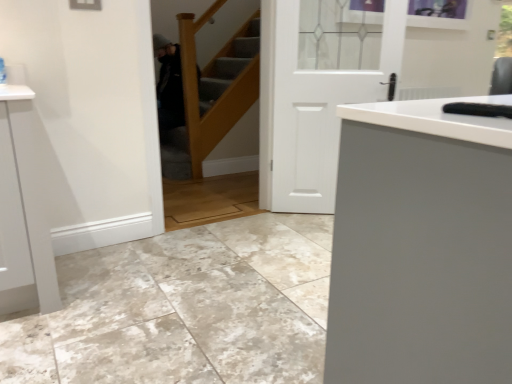
Question: Is white wooden door at center further to the viewer compared to wooden stairwell at center?

Choices:
 (A) yes
 (B) no

Answer: (A)

Question: Is white wooden door at center next to wooden stairwell at center and touching it?

Choices:
 (A) yes
 (B) no

Answer: (B)

Question: Is wooden stairwell at center at the back of white wooden door at center?

Choices:
 (A) no
 (B) yes

Answer: (A)

Question: Is white wooden door at center facing towards wooden stairwell at center?

Choices:
 (A) no
 (B) yes

Answer: (A)

Question: Is white wooden door at center shorter than wooden stairwell at center?

Choices:
 (A) yes
 (B) no

Answer: (A)

Question: Is white wooden door at center bigger than wooden stairwell at center?

Choices:
 (A) yes
 (B) no

Answer: (B)

Question: Is wooden stairwell at center facing towards white wooden door at center?

Choices:
 (A) yes
 (B) no

Answer: (B)

Question: Is wooden stairwell at center not inside white wooden door at center?

Choices:
 (A) yes
 (B) no

Answer: (A)

Question: From a real-world perspective, is wooden stairwell at center located beneath white wooden door at center?

Choices:
 (A) no
 (B) yes

Answer: (A)

Question: Is wooden stairwell at center far away from white wooden door at center?

Choices:
 (A) no
 (B) yes

Answer: (B)

Question: Considering the relative sizes of wooden stairwell at center and white wooden door at center in the image provided, is wooden stairwell at center smaller than white wooden door at center?

Choices:
 (A) no
 (B) yes

Answer: (A)

Question: From the image's perspective, is wooden stairwell at center over white wooden door at center?

Choices:
 (A) yes
 (B) no

Answer: (A)

Question: From a real-world perspective, is white wooden door at center physically located above or below wooden stairwell at center?

Choices:
 (A) below
 (B) above

Answer: (A)